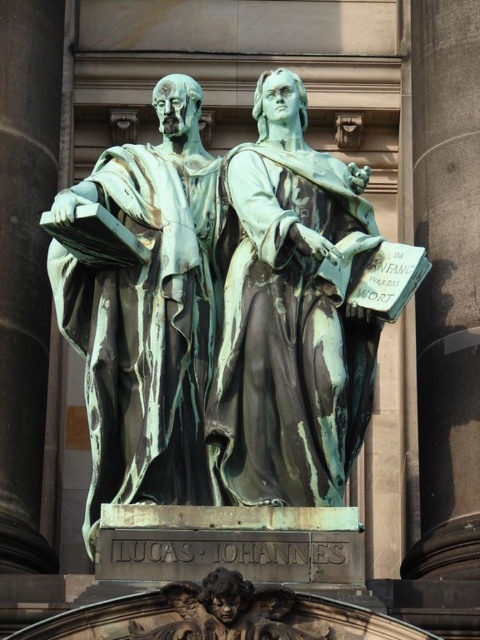
Question: Which point is farther to the camera?

Choices:
 (A) bronze statue at center
 (B) green patina statue at left

Answer: (B)

Question: Which point is farther to the camera?

Choices:
 (A) green patina statue at left
 (B) bronze statue at center

Answer: (A)

Question: Does bronze statue at center appear on the left side of green patina statue at left?

Choices:
 (A) no
 (B) yes

Answer: (A)

Question: Is bronze statue at center to the left of green patina statue at left from the viewer's perspective?

Choices:
 (A) yes
 (B) no

Answer: (B)

Question: Does bronze statue at center have a lesser width compared to green patina statue at left?

Choices:
 (A) no
 (B) yes

Answer: (B)

Question: Which point is farther to the camera?

Choices:
 (A) (252, 365)
 (B) (92, 320)

Answer: (B)